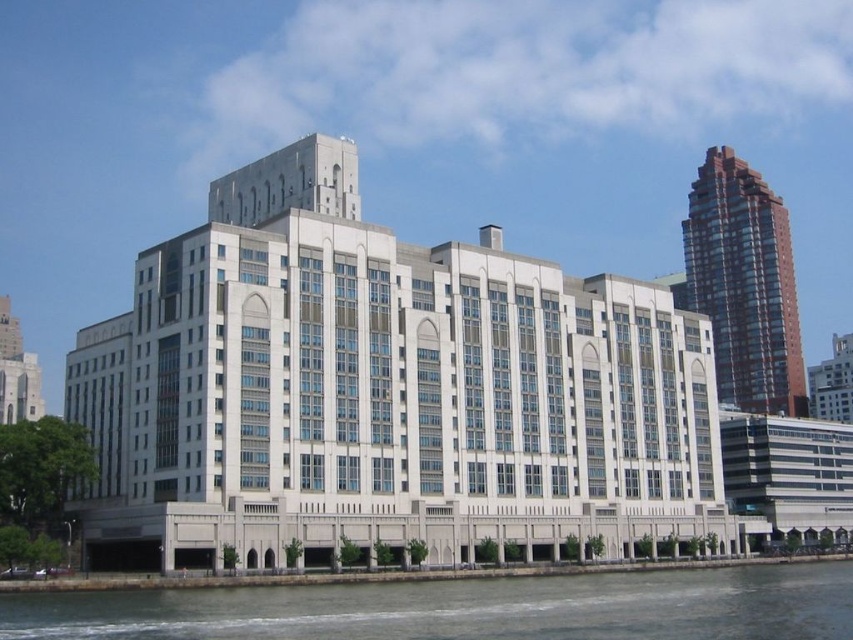
Between white stone building at center and brown glassy tower at upper right, which one has more height?

With more height is brown glassy tower at upper right.

Can you confirm if white stone building at center is positioned above brown glassy tower at upper right?

Actually, white stone building at center is below brown glassy tower at upper right.

Image resolution: width=853 pixels, height=640 pixels. What are the coordinates of `white stone building at center` in the screenshot? It's located at (386, 392).

Does white stone building at center have a lesser height compared to gray water at lower center?

In fact, white stone building at center may be taller than gray water at lower center.

Which is more to the left, white stone building at center or gray water at lower center?

white stone building at center is more to the left.

At what (x,y) coordinates should I click in order to perform the action: click on white stone building at center. Please return your answer as a coordinate pair (x, y). The image size is (853, 640). Looking at the image, I should click on (386, 392).

This screenshot has height=640, width=853. What are the coordinates of `white stone building at center` in the screenshot? It's located at (386, 392).

Can you confirm if gray water at lower center is positioned below brown glassy tower at upper right?

Indeed, gray water at lower center is positioned under brown glassy tower at upper right.

Is gray water at lower center positioned at the back of brown glassy tower at upper right?

No, it is not.

This screenshot has width=853, height=640. What are the coordinates of `gray water at lower center` in the screenshot? It's located at (463, 609).